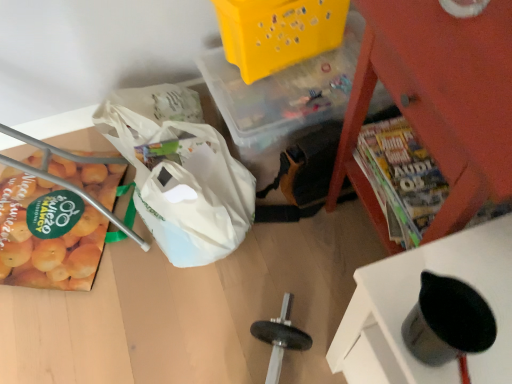
Question: Is white plastic grocery bag at lower left spatially inside metallic red magazine rack at upper right, arranged as the first furniture when viewed from the back, or outside of it?

Choices:
 (A) inside
 (B) outside

Answer: (B)

Question: From a real-world perspective, relative to metallic red magazine rack at upper right, the second furniture positioned from the front, is white plastic grocery bag at lower left vertically above or below?

Choices:
 (A) below
 (B) above

Answer: (A)

Question: Estimate the real-world distances between objects in this image. Which object is closer to the silver metallic cup at lower right, the second furniture viewed from the back?

Choices:
 (A) yellow matte oranges at left
 (B) metallic red magazine rack at upper right, arranged as the first furniture when viewed from the back
 (C) yellow plastic basket at upper center
 (D) white plastic grocery bag at lower left

Answer: (B)

Question: Based on their relative distances, which object is nearer to the yellow plastic basket at upper center?

Choices:
 (A) white plastic grocery bag at lower left
 (B) silver metallic cup at lower right, arranged as the 1th furniture when viewed from the front
 (C) metallic red magazine rack at upper right, the second furniture positioned from the front
 (D) yellow matte oranges at left

Answer: (A)